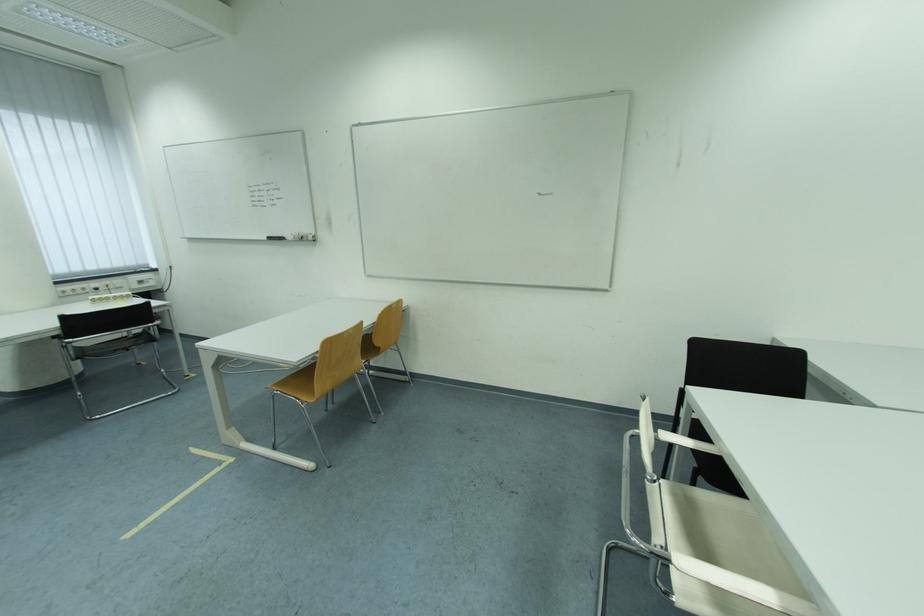
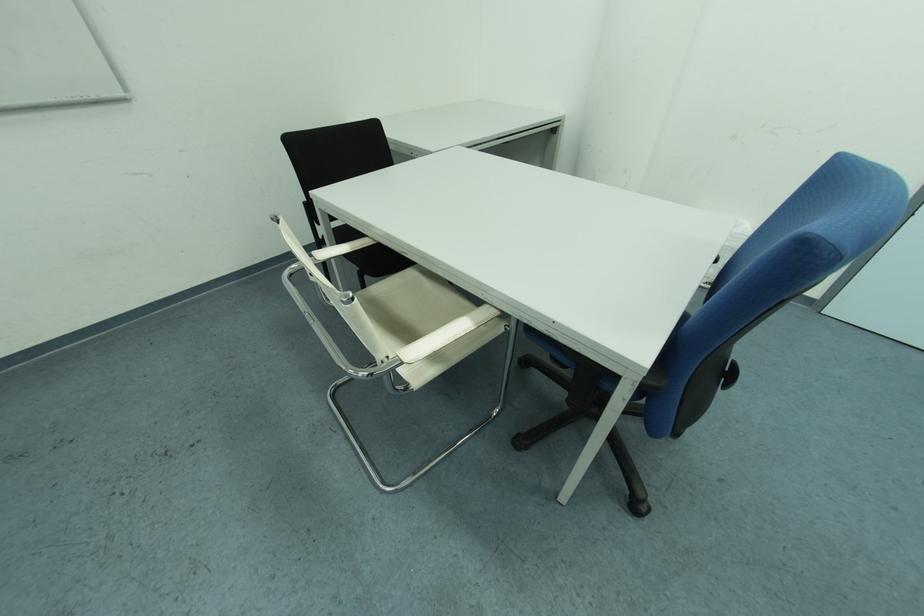
In the second image, find the point that corresponds to [702,485] in the first image.

(372, 286)